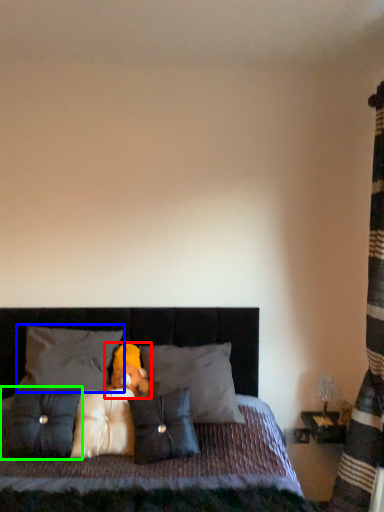
Question: Which is farther away from teddy bear (highlighted by a red box)? pillow (highlighted by a blue box) or pillow (highlighted by a green box)?

Choices:
 (A) pillow
 (B) pillow

Answer: (B)